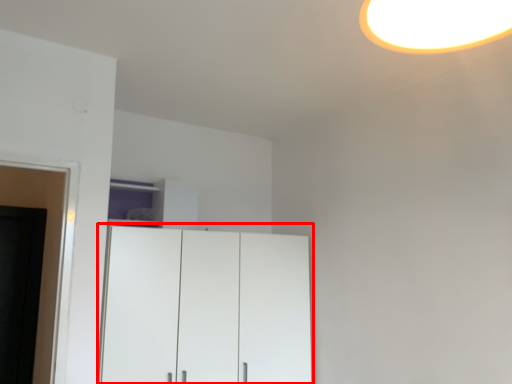
Question: From the image's perspective, considering the relative positions of cupboard (annotated by the red box) and cabinetry in the image provided, where is cupboard (annotated by the red box) located with respect to the staircase?

Choices:
 (A) below
 (B) above

Answer: (A)